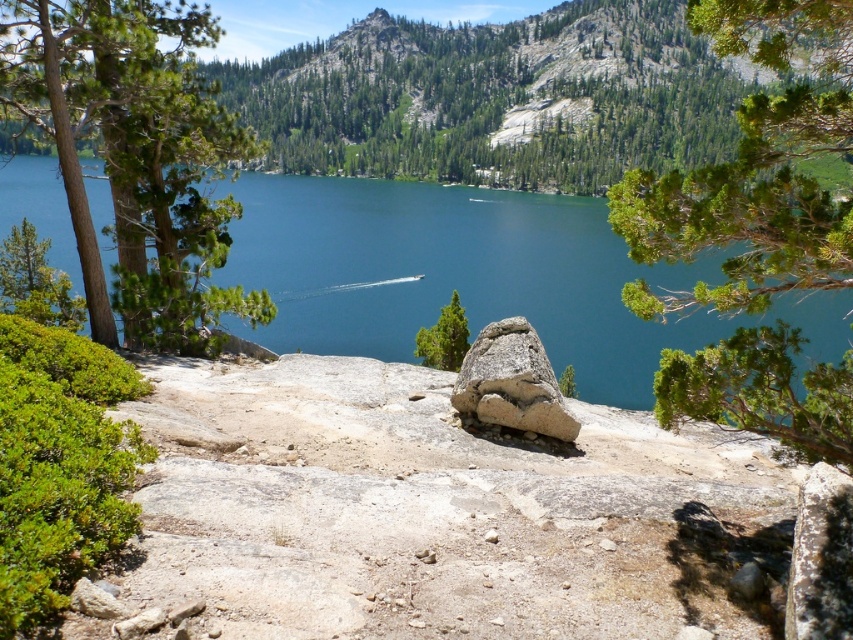
Question: From the image, what is the correct spatial relationship of blue-green water at center in relation to green textured rock at center?

Choices:
 (A) above
 (B) below

Answer: (A)

Question: Among these points, which one is farthest from the camera?

Choices:
 (A) (450, 314)
 (B) (560, 412)

Answer: (A)

Question: Can you confirm if green leafy tree at upper center is positioned above green textured rock at center?

Choices:
 (A) no
 (B) yes

Answer: (B)

Question: Which point is farther to the camera?

Choices:
 (A) green leafy tree at upper center
 (B) blue-green water at center

Answer: (B)

Question: Among these objects, which one is nearest to the camera?

Choices:
 (A) green leafy tree at upper center
 (B) green textured tree at left
 (C) blue-green water at center

Answer: (A)

Question: Does gray rock at center have a larger size compared to green textured rock at center?

Choices:
 (A) no
 (B) yes

Answer: (A)